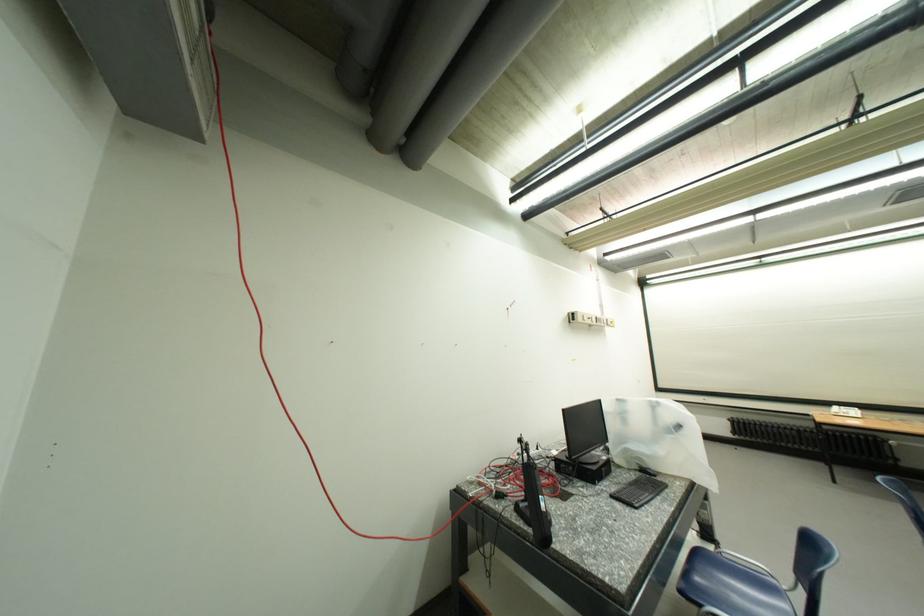
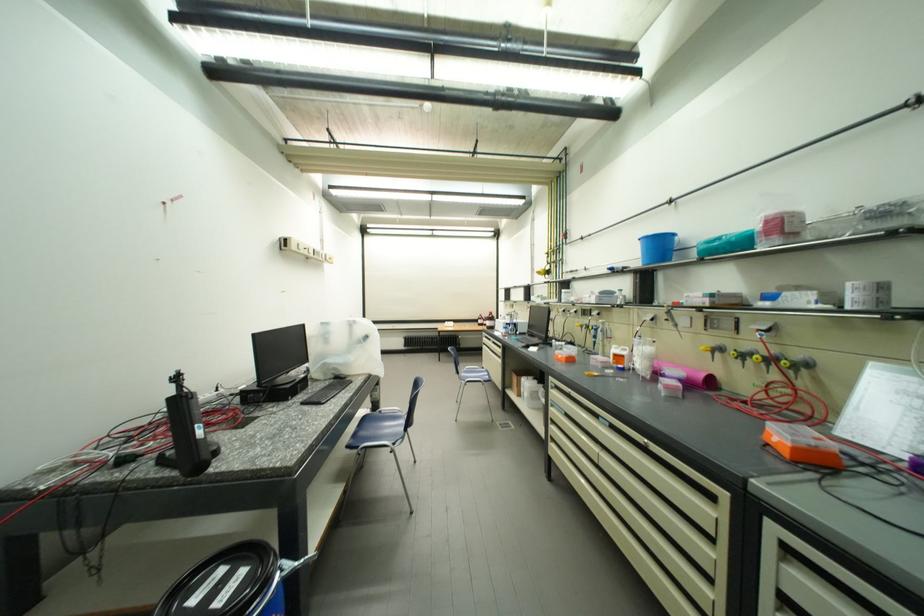
Question: The camera is either moving clockwise (left) or counter-clockwise (right) around the object. The first image is from the beginning of the video and the second image is from the end. Is the camera moving left or right when shooting the video?

Choices:
 (A) Left
 (B) Right

Answer: (A)